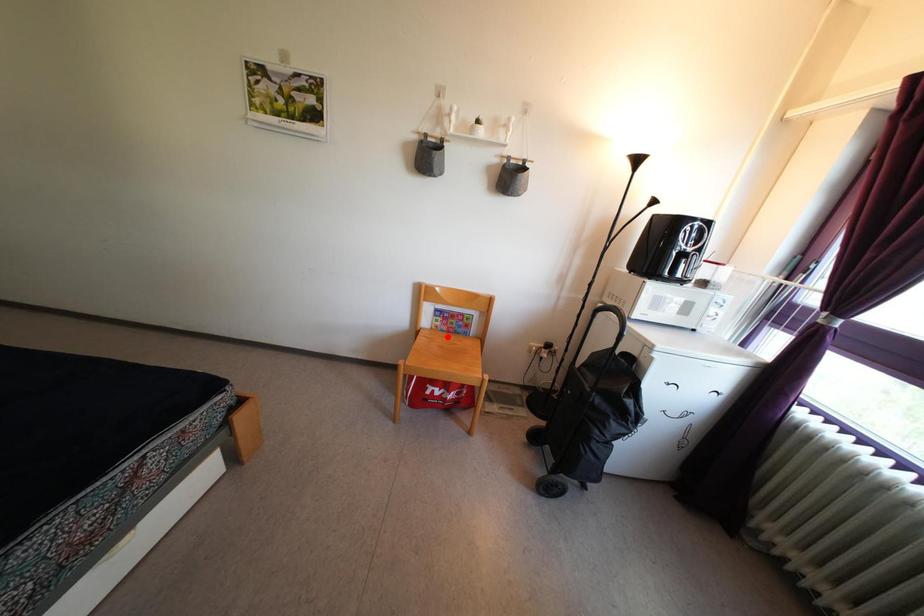
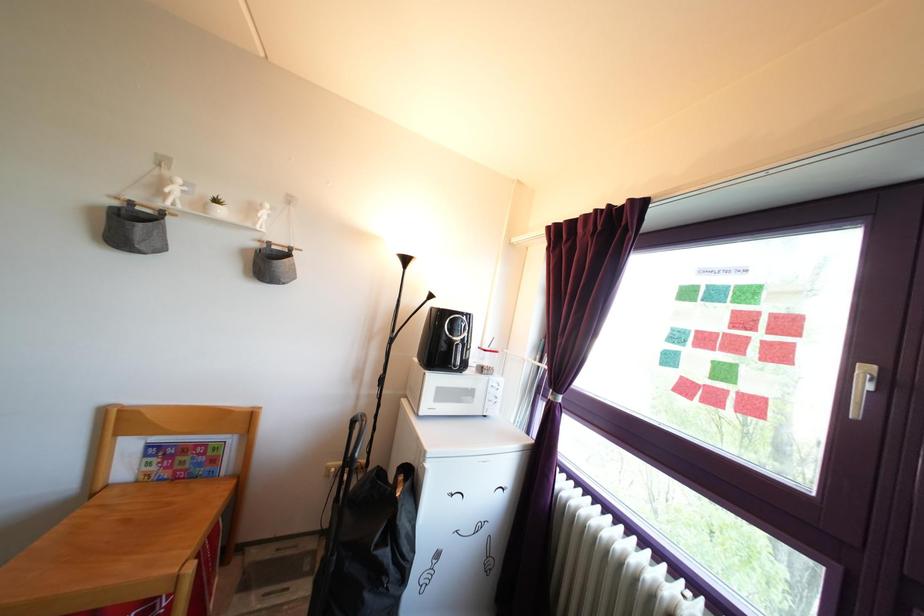
Question: I am providing you with two images of the same scene from different viewpoints. In image1, a red point is highlighted. Considering the same 3D point in image2, which of the following is correct?

Choices:
 (A) It is closer
 (B) It is farther

Answer: (A)